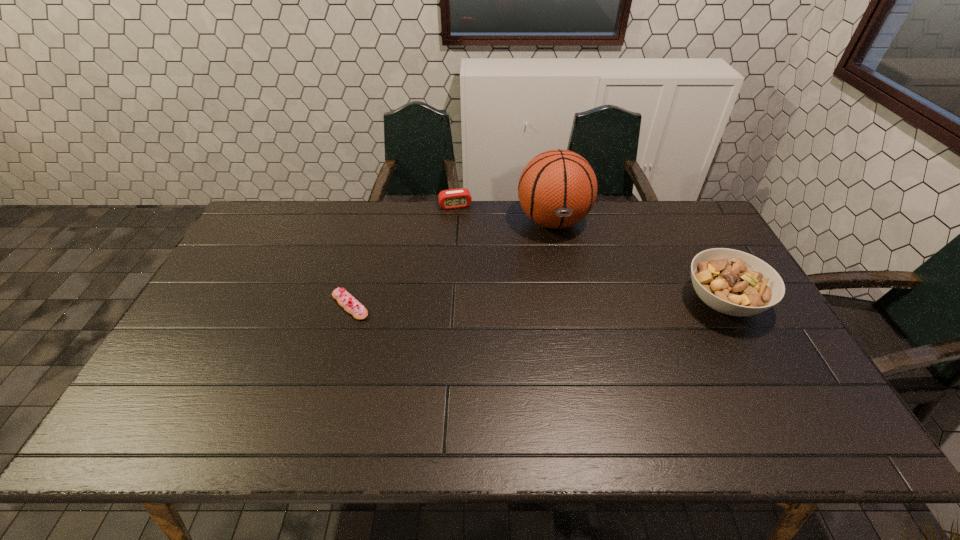
I want to click on the leftmost object, so click(346, 300).

Identify the location of the shortest object. The image size is (960, 540). (346, 300).

The height and width of the screenshot is (540, 960). Find the location of `the third shortest object`. the third shortest object is located at coordinates (732, 282).

Find the location of `the rightmost object`. the rightmost object is located at coordinates (732, 282).

Identify the location of the third object from left to right. The height and width of the screenshot is (540, 960). (557, 189).

Identify the location of the tallest object. (557, 189).

Where is `the third object from right to left`? The width and height of the screenshot is (960, 540). the third object from right to left is located at coordinates (454, 198).

Find the location of a particular element. The image size is (960, 540). alarm clock is located at coordinates point(454,198).

Where is `vacant space located on the left of the leftmost object`? The image size is (960, 540). vacant space located on the left of the leftmost object is located at coordinates (249, 306).

This screenshot has width=960, height=540. Identify the location of vacant area located 0.120m on the front of the third shortest object. (760, 372).